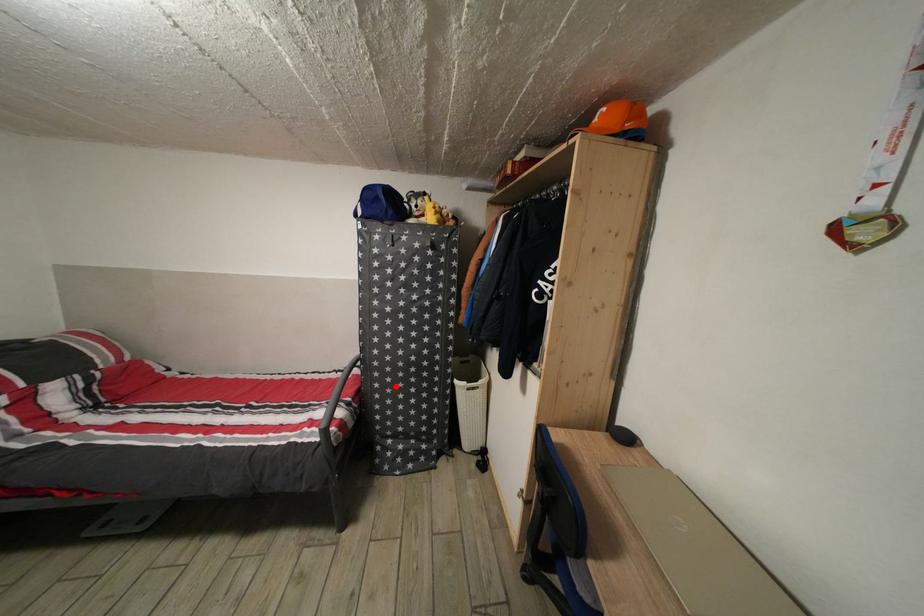
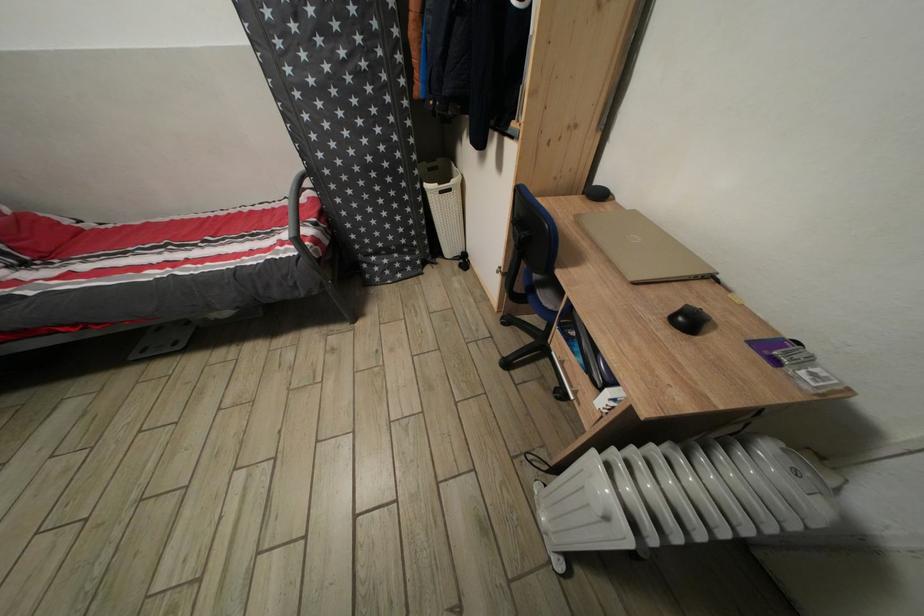
The point at the highlighted location is marked in the first image. Where is the corresponding point in the second image?

(357, 198)